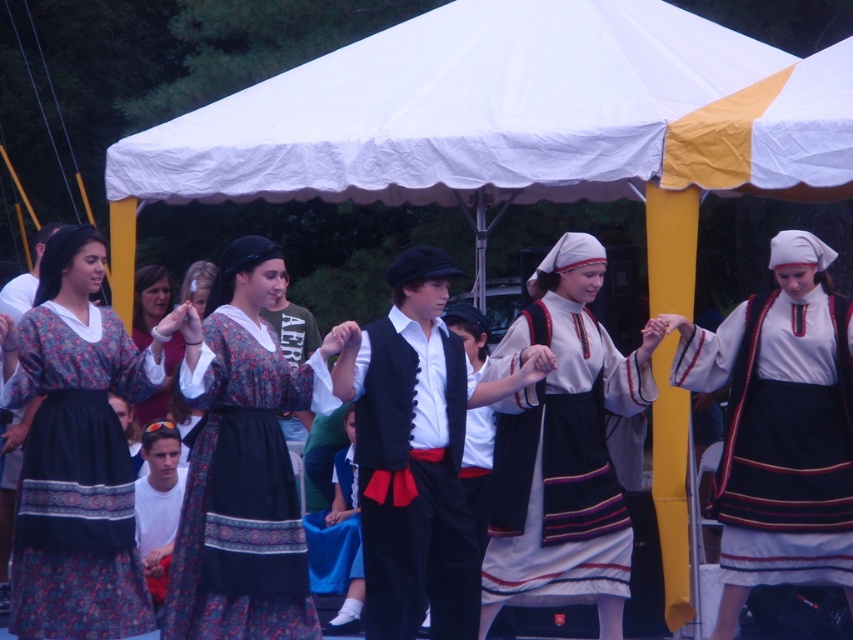
You are a photographer at the festival and want to capture both the printed fabric dress at center and the matte floral dress at center in the same frame. Which dress should you position closer to the left side of your camera viewfinder to ensure both are visible?

The printed fabric dress at center is to the left of the matte floral dress at center, so positioning the printed fabric dress at center closer to the left side of the camera viewfinder will ensure both dresses are visible in the frame.

You are a photographer at the festival and want to capture both the printed fabric dress at center and the matte floral dress at center in a single frame. Since you want to highlight the bigger one, which dress should you focus on first?

The printed fabric dress at center is bigger than the matte floral dress at center, so you should focus on the printed fabric dress at center first to highlight its size.

You are a photographer at the festival and want to capture the printed fabric dress at center in your shot. Based on its position, where should you aim your camera relative to the dancers?

The printed fabric dress at center is located at point (76, 451), which means you should aim your camera slightly to the right and lower down to capture it effectively.